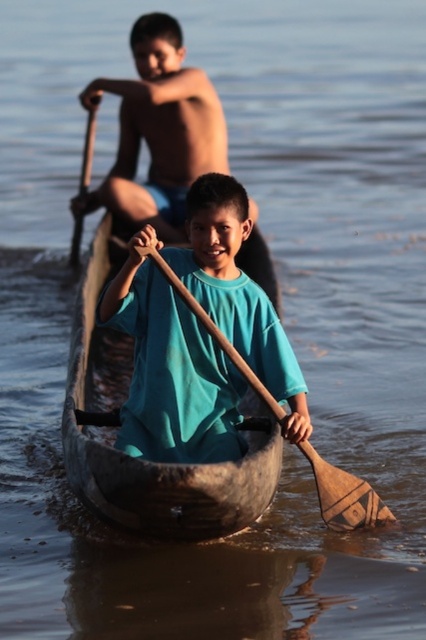
You are standing on the shore of a lake and see a canoe with two boys. The point in the canoe labeled as point (91,464) is 31.18 feet away from you. If you want to throw a lifebuoy to the boys, will it reach them?

The point labeled (91,464) is 31.18 feet away from you, so the lifebuoy can reach the boys in the canoe because the distance is within the typical throwing range of a lifebuoy.

Consider the image. You are a photographer trying to capture the two boys in the brown wooden boat at center. You need to ensure the boat is clearly visible in your shot. Considering the size of the wooden paddle at center, will the boat appear wider than the paddle in your photo?

The brown wooden boat at center is wider than the wooden paddle at center, so yes, the boat will appear wider than the paddle in the photo.

You are trying to decide which paddle to use for a quick turn in the canoe. The wooden paddle at center and the wooden paddle at upper left are available. Based on their sizes, which paddle might be more suitable for a quick turn and why?

The wooden paddle at center has a smaller width than the wooden paddle at upper left, so it might be more suitable for a quick turn because a narrower paddle can maneuver faster in the water.